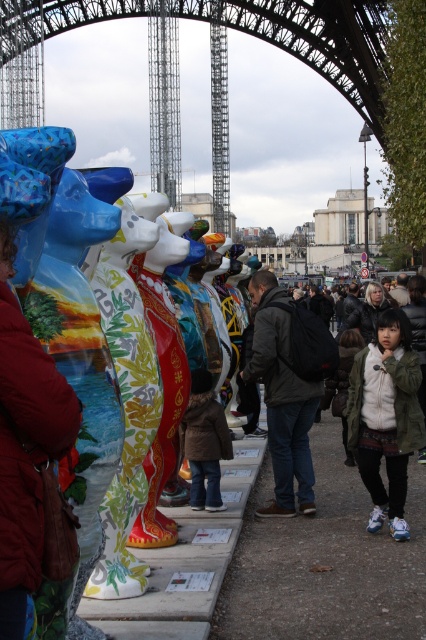
You are a delivery robot with a 2.5 meter wide package. You need to navigate through the path between the matte red coat at center and the brown fuzzy coat at center. Can you fit through the path?

The distance between the matte red coat at center and brown fuzzy coat at center is 36.96 meters, so yes, the delivery robot with a 2.5 meter wide package can fit through the path between them since the distance is much wider than the package.